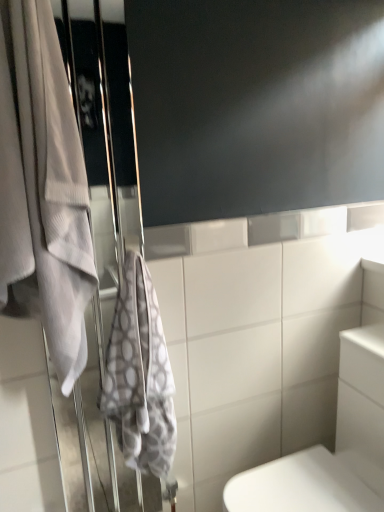
Question: From the image's perspective, is white glossy toilet at lower right on white fabric screen door at left?

Choices:
 (A) yes
 (B) no

Answer: (B)

Question: Is white fabric screen door at left completely or partially inside white glossy toilet at lower right?

Choices:
 (A) no
 (B) yes

Answer: (A)

Question: From a real-world perspective, is white glossy toilet at lower right located higher than white fabric screen door at left?

Choices:
 (A) no
 (B) yes

Answer: (A)

Question: Considering the relative positions of white glossy toilet at lower right and white fabric screen door at left in the image provided, is white glossy toilet at lower right to the right of white fabric screen door at left from the viewer's perspective?

Choices:
 (A) yes
 (B) no

Answer: (A)

Question: Is white glossy toilet at lower right shorter than white fabric screen door at left?

Choices:
 (A) yes
 (B) no

Answer: (A)

Question: From a real-world perspective, relative to white glossy toilet at lower right, is gray textured towel at left, which is the second towel from left to right, vertically above or below?

Choices:
 (A) below
 (B) above

Answer: (B)

Question: Is gray textured towel at left, which is the second towel from left to right, inside or outside of white glossy toilet at lower right?

Choices:
 (A) inside
 (B) outside

Answer: (B)

Question: In terms of width, does gray textured towel at left, marked as the first towel in a right-to-left arrangement, look wider or thinner when compared to white glossy toilet at lower right?

Choices:
 (A) wide
 (B) thin

Answer: (B)

Question: From the image's perspective, is gray textured towel at left, which is the second towel from left to right, positioned above or below white glossy toilet at lower right?

Choices:
 (A) below
 (B) above

Answer: (B)

Question: Is point (347, 441) closer or farther from the camera than point (16, 164)?

Choices:
 (A) farther
 (B) closer

Answer: (A)

Question: In the image, is white glossy toilet at lower right on the left side or the right side of white textured towel at left, the 1th towel when ordered from left to right?

Choices:
 (A) left
 (B) right

Answer: (B)

Question: In terms of size, does white glossy toilet at lower right appear bigger or smaller than white textured towel at left, the 1th towel when ordered from left to right?

Choices:
 (A) big
 (B) small

Answer: (A)

Question: From a real-world perspective, is white glossy toilet at lower right physically located above or below white textured towel at left, the 1th towel when ordered from left to right?

Choices:
 (A) above
 (B) below

Answer: (B)

Question: Do you think white textured towel at left, the 1th towel when ordered from left to right, is within gray textured towel at left, marked as the first towel in a right-to-left arrangement, or outside of it?

Choices:
 (A) outside
 (B) inside

Answer: (A)

Question: Looking at their shapes, would you say white textured towel at left, arranged as the 2th towel when viewed from the right, is wider or thinner than gray textured towel at left, which is the second towel from left to right?

Choices:
 (A) wide
 (B) thin

Answer: (A)